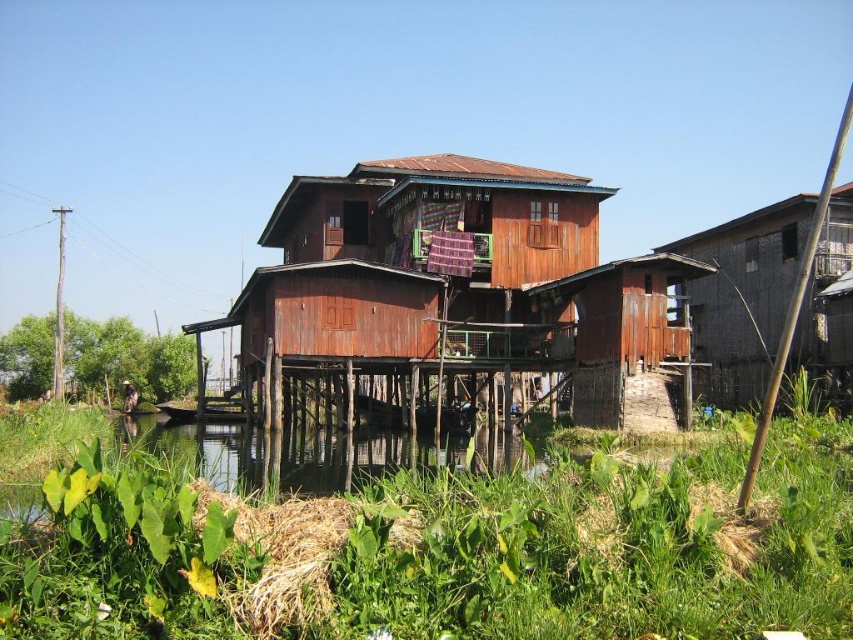
Question: Can you confirm if rusty wood house at center is positioned above wooden hut at right?

Choices:
 (A) yes
 (B) no

Answer: (A)

Question: Does rusty wood house at center have a lesser width compared to green grassy river at lower left?

Choices:
 (A) yes
 (B) no

Answer: (A)

Question: Can you confirm if rusty wood house at center is thinner than green grassy river at lower left?

Choices:
 (A) no
 (B) yes

Answer: (B)

Question: Which point appears closest to the camera in this image?

Choices:
 (A) (697, 316)
 (B) (521, 458)

Answer: (B)

Question: Which object is positioned closest to the wooden hut at right?

Choices:
 (A) green grassy river at lower left
 (B) rusty wood house at center

Answer: (B)

Question: Which object is positioned farthest from the rusty wood house at center?

Choices:
 (A) wooden hut at right
 (B) green grassy river at lower left

Answer: (A)